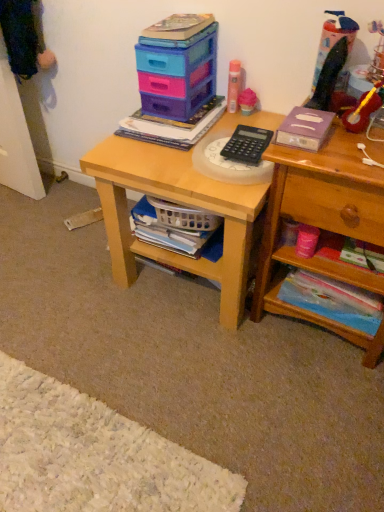
This screenshot has height=512, width=384. What are the coordinates of `vacant area that is in front of light wood desk at center` in the screenshot? It's located at (182, 375).